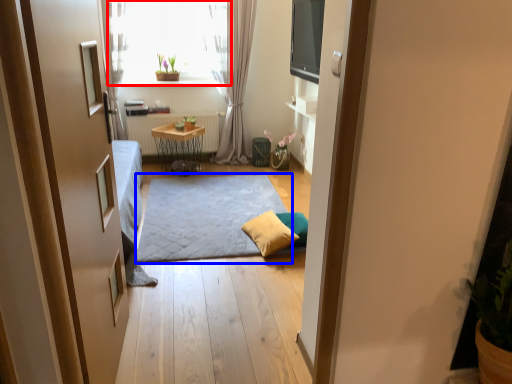
Question: Which of the following is the farthest to the observer, window (highlighted by a red box) or doormat (highlighted by a blue box)?

Choices:
 (A) window
 (B) doormat

Answer: (A)